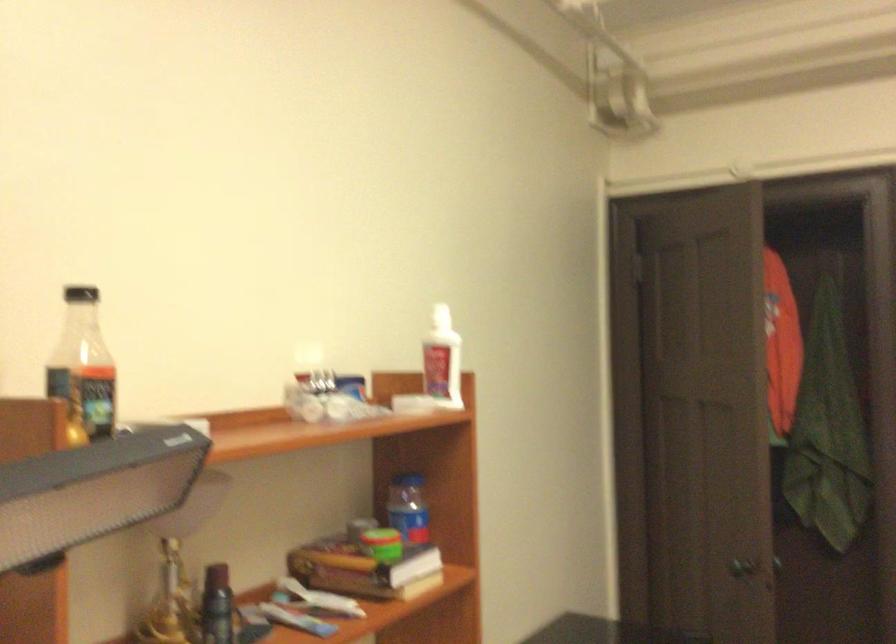
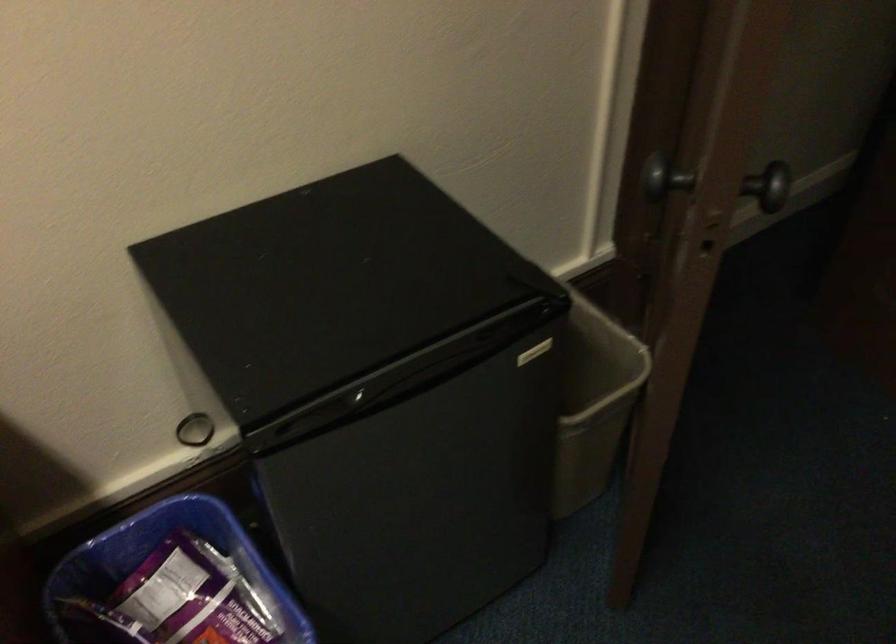
Where in the second image is the point corresponding to [779,554] from the first image?

(771, 185)